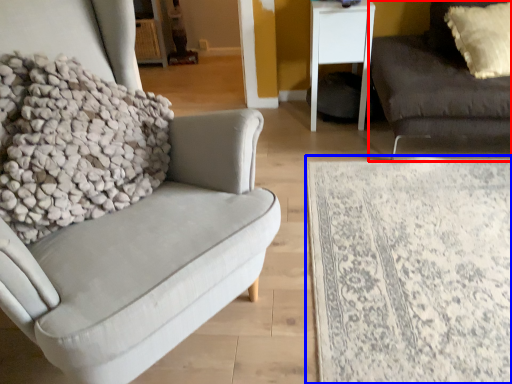
Question: Which object appears closest to the camera in this image, studio couch (highlighted by a red box) or plain (highlighted by a blue box)?

Choices:
 (A) studio couch
 (B) plain

Answer: (B)